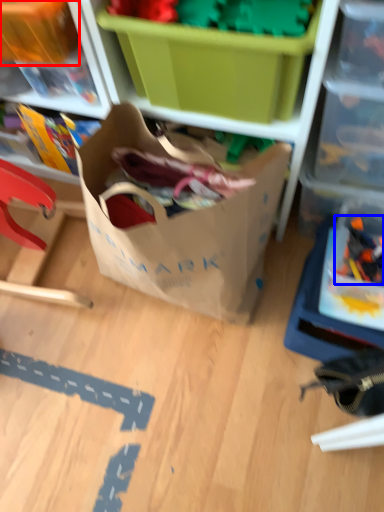
Question: Which point is closer to the camera, storage box (highlighted by a red box) or toy (highlighted by a blue box)?

Choices:
 (A) storage box
 (B) toy

Answer: (A)